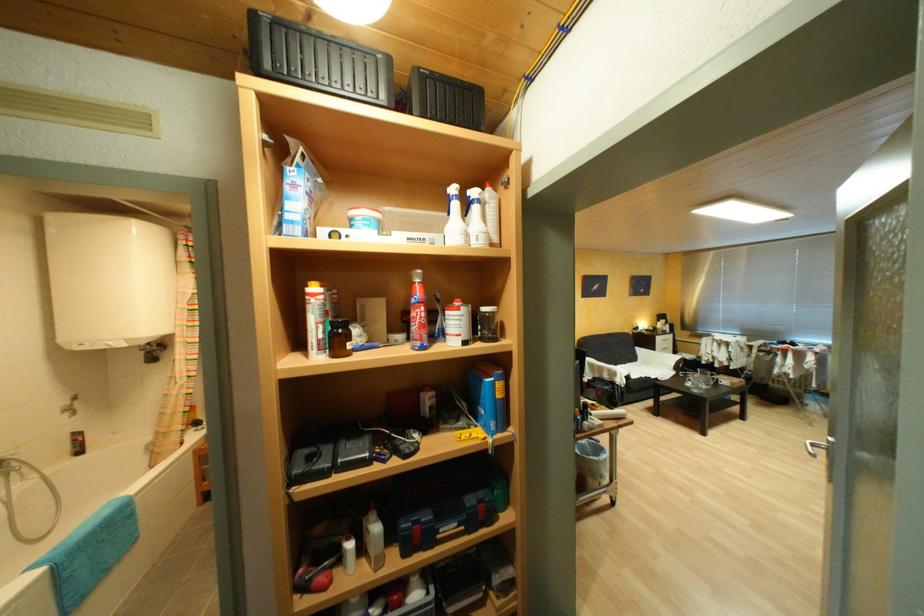
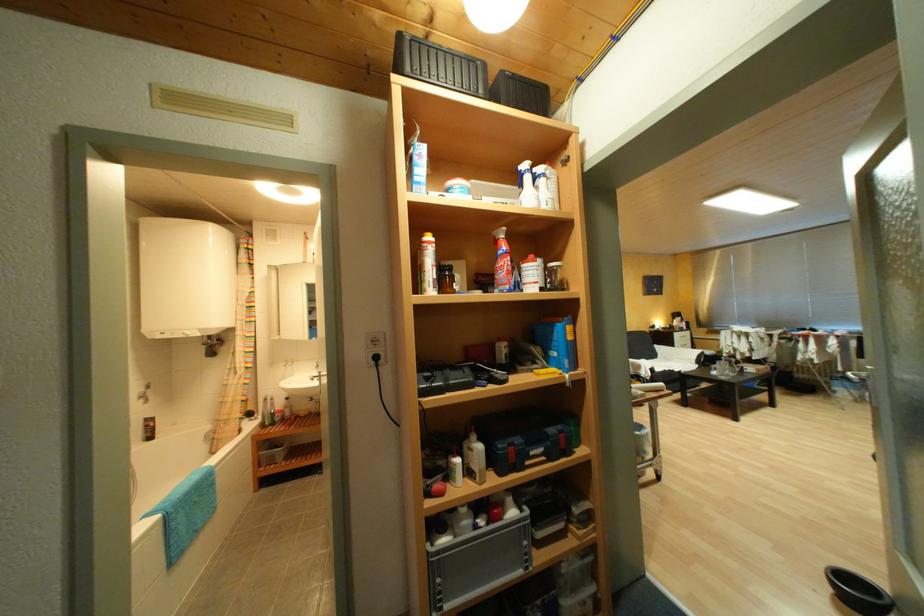
Find the pixel in the second image that matches point 382,517 in the first image.

(482, 438)